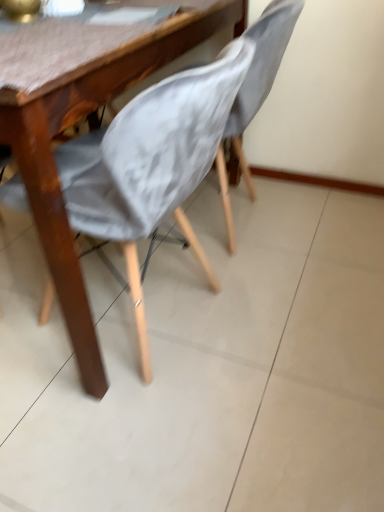
Where is `matte gray fabric chair at center, which ranks as the 1th chair in left-to-right order`? matte gray fabric chair at center, which ranks as the 1th chair in left-to-right order is located at coordinates (184, 142).

How much space does matte gray fabric chair at center, which ranks as the 1th chair in left-to-right order, occupy horizontally?

matte gray fabric chair at center, which ranks as the 1th chair in left-to-right order, is 3.93 feet in width.

This screenshot has width=384, height=512. Describe the element at coordinates (184, 142) in the screenshot. I see `matte gray fabric chair at center, the 2th chair when ordered from right to left` at that location.

This screenshot has width=384, height=512. Identify the location of gray fabric chair at center, the 1th chair when ordered from right to left. (261, 71).

What do you see at coordinates (261, 71) in the screenshot?
I see `gray fabric chair at center, arranged as the second chair when viewed from the left` at bounding box center [261, 71].

You are a GUI agent. You are given a task and a screenshot of the screen. Output one action in this format:
    pyautogui.click(x=<x>, y=<y>)
    Task: Click on the matte gray fabric chair at center, which ranks as the 1th chair in left-to-right order
    
    Given the screenshot: What is the action you would take?
    pyautogui.click(x=184, y=142)

Considering the relative positions of gray fabric chair at center, arranged as the second chair when viewed from the left, and matte gray fabric chair at center, which ranks as the 1th chair in left-to-right order, in the image provided, is gray fabric chair at center, arranged as the second chair when viewed from the left, to the right of matte gray fabric chair at center, which ranks as the 1th chair in left-to-right order, from the viewer's perspective?

Yes.

Is gray fabric chair at center, arranged as the second chair when viewed from the left, closer to the viewer compared to matte gray fabric chair at center, which ranks as the 1th chair in left-to-right order?

No, gray fabric chair at center, arranged as the second chair when viewed from the left, is further to the viewer.

Which point is more distant from viewer, (286, 38) or (204, 264)?

The point (204, 264) is behind.

From the image's perspective, is gray fabric chair at center, the 1th chair when ordered from right to left, above or below matte gray fabric chair at center, the 2th chair when ordered from right to left?

Clearly, from the image's perspective, gray fabric chair at center, the 1th chair when ordered from right to left, is above matte gray fabric chair at center, the 2th chair when ordered from right to left.

From a real-world perspective, is gray fabric chair at center, the 1th chair when ordered from right to left, positioned under matte gray fabric chair at center, the 2th chair when ordered from right to left, based on gravity?

No, from a real-world perspective, gray fabric chair at center, the 1th chair when ordered from right to left, is not below matte gray fabric chair at center, the 2th chair when ordered from right to left.

Can you confirm if gray fabric chair at center, the 1th chair when ordered from right to left, is wider than matte gray fabric chair at center, which ranks as the 1th chair in left-to-right order?

No, gray fabric chair at center, the 1th chair when ordered from right to left, is not wider than matte gray fabric chair at center, which ranks as the 1th chair in left-to-right order.

Considering the relative sizes of gray fabric chair at center, the 1th chair when ordered from right to left, and matte gray fabric chair at center, the 2th chair when ordered from right to left, in the image provided, is gray fabric chair at center, the 1th chair when ordered from right to left, shorter than matte gray fabric chair at center, the 2th chair when ordered from right to left,?

No, gray fabric chair at center, the 1th chair when ordered from right to left, is not shorter than matte gray fabric chair at center, the 2th chair when ordered from right to left.

Is gray fabric chair at center, arranged as the second chair when viewed from the left, bigger or smaller than matte gray fabric chair at center, the 2th chair when ordered from right to left?

Considering their sizes, gray fabric chair at center, arranged as the second chair when viewed from the left, takes up less space than matte gray fabric chair at center, the 2th chair when ordered from right to left.

Is matte gray fabric chair at center, the 2th chair when ordered from right to left, a part of gray fabric chair at center, arranged as the second chair when viewed from the left?

No, matte gray fabric chair at center, the 2th chair when ordered from right to left, is not surrounded by gray fabric chair at center, arranged as the second chair when viewed from the left.

Is gray fabric chair at center, arranged as the second chair when viewed from the left, touching matte gray fabric chair at center, which ranks as the 1th chair in left-to-right order?

No, gray fabric chair at center, arranged as the second chair when viewed from the left, is not next to matte gray fabric chair at center, which ranks as the 1th chair in left-to-right order.

Is gray fabric chair at center, arranged as the second chair when viewed from the left, aimed at matte gray fabric chair at center, which ranks as the 1th chair in left-to-right order?

Yes.

Find the location of a particular element. This screenshot has width=384, height=512. chair below the gray fabric chair at center, the 1th chair when ordered from right to left (from the image's perspective) is located at coordinates (184, 142).

In the image, is matte gray fabric chair at center, the 2th chair when ordered from right to left, on the left side or the right side of gray fabric chair at center, the 1th chair when ordered from right to left?

Based on their positions, matte gray fabric chair at center, the 2th chair when ordered from right to left, is located to the left of gray fabric chair at center, the 1th chair when ordered from right to left.

Which object is further away from the camera, matte gray fabric chair at center, the 2th chair when ordered from right to left, or gray fabric chair at center, the 1th chair when ordered from right to left?

→ gray fabric chair at center, the 1th chair when ordered from right to left.

Is point (141, 151) positioned in front of point (300, 0)?

Yes.

From the image's perspective, which one is positioned lower, matte gray fabric chair at center, which ranks as the 1th chair in left-to-right order, or gray fabric chair at center, arranged as the second chair when viewed from the left?

From the image's view, matte gray fabric chair at center, which ranks as the 1th chair in left-to-right order, is below.

From a real-world perspective, which object stands above the other?

gray fabric chair at center, the 1th chair when ordered from right to left, is physically above.

In terms of width, does matte gray fabric chair at center, the 2th chair when ordered from right to left, look wider or thinner when compared to gray fabric chair at center, the 1th chair when ordered from right to left?

matte gray fabric chair at center, the 2th chair when ordered from right to left, is wider than gray fabric chair at center, the 1th chair when ordered from right to left.

Between matte gray fabric chair at center, which ranks as the 1th chair in left-to-right order, and gray fabric chair at center, arranged as the second chair when viewed from the left, which one has less height?

With less height is matte gray fabric chair at center, which ranks as the 1th chair in left-to-right order.

Is matte gray fabric chair at center, which ranks as the 1th chair in left-to-right order, smaller than gray fabric chair at center, the 1th chair when ordered from right to left?

No.

Does matte gray fabric chair at center, the 2th chair when ordered from right to left, contain gray fabric chair at center, arranged as the second chair when viewed from the left?

Yes, gray fabric chair at center, arranged as the second chair when viewed from the left, can be found within matte gray fabric chair at center, the 2th chair when ordered from right to left.

Is matte gray fabric chair at center, which ranks as the 1th chair in left-to-right order, not close to gray fabric chair at center, arranged as the second chair when viewed from the left?

matte gray fabric chair at center, which ranks as the 1th chair in left-to-right order, is near gray fabric chair at center, arranged as the second chair when viewed from the left, not far away.

Is matte gray fabric chair at center, which ranks as the 1th chair in left-to-right order, oriented towards gray fabric chair at center, arranged as the second chair when viewed from the left?

No, matte gray fabric chair at center, which ranks as the 1th chair in left-to-right order, is not oriented towards gray fabric chair at center, arranged as the second chair when viewed from the left.

How far apart are matte gray fabric chair at center, which ranks as the 1th chair in left-to-right order, and gray fabric chair at center, the 1th chair when ordered from right to left?

matte gray fabric chair at center, which ranks as the 1th chair in left-to-right order, is 36.43 centimeters away from gray fabric chair at center, the 1th chair when ordered from right to left.

You are a GUI agent. You are given a task and a screenshot of the screen. Output one action in this format:
    pyautogui.click(x=<x>, y=<y>)
    Task: Click on the chair behind the matte gray fabric chair at center, the 2th chair when ordered from right to left
    Image resolution: width=384 pixels, height=512 pixels.
    Given the screenshot: What is the action you would take?
    pyautogui.click(x=261, y=71)

Where is `chair positioned vertically above the matte gray fabric chair at center, the 2th chair when ordered from right to left (from a real-world perspective)`? This screenshot has height=512, width=384. chair positioned vertically above the matte gray fabric chair at center, the 2th chair when ordered from right to left (from a real-world perspective) is located at coordinates (261, 71).

Where is `chair that appears below the gray fabric chair at center, the 1th chair when ordered from right to left (from a real-world perspective)`? chair that appears below the gray fabric chair at center, the 1th chair when ordered from right to left (from a real-world perspective) is located at coordinates (184, 142).